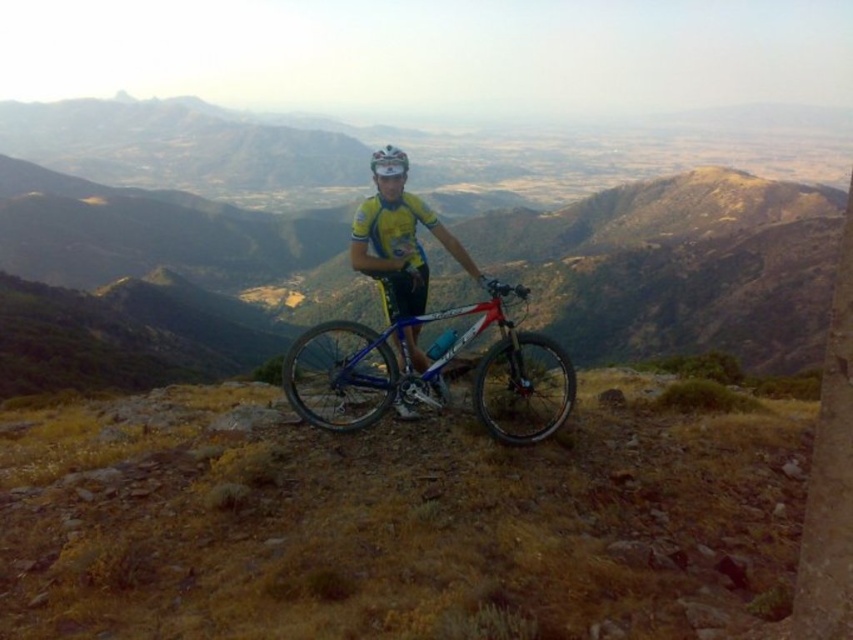
Question: Which object is positioned farthest from the brown grassy terrain at center?

Choices:
 (A) blue metallic bicycle at center
 (B) white matte bicycle helmet at center

Answer: (B)

Question: Does brown grassy terrain at center have a greater width compared to yellow jersey at center?

Choices:
 (A) no
 (B) yes

Answer: (B)

Question: Which point appears closest to the camera in this image?

Choices:
 (A) (378, 154)
 (B) (381, 209)
 (C) (363, 323)

Answer: (A)

Question: Is the position of brown grassy terrain at center more distant than that of white matte bicycle helmet at center?

Choices:
 (A) yes
 (B) no

Answer: (B)

Question: Based on their relative distances, which object is nearer to the white matte bicycle helmet at center?

Choices:
 (A) brown grassy terrain at center
 (B) yellow jersey at center

Answer: (B)

Question: Does yellow jersey at center have a smaller size compared to white matte bicycle helmet at center?

Choices:
 (A) yes
 (B) no

Answer: (A)